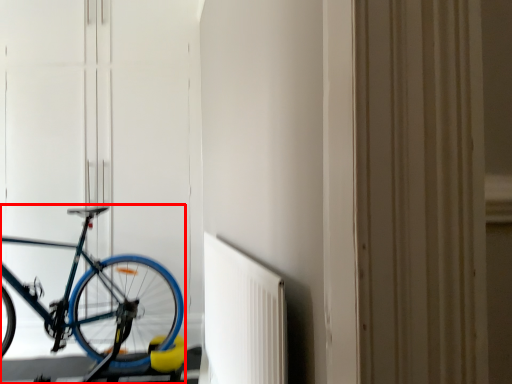
Question: From the image's perspective, where is bicycle (annotated by the red box) located in relation to radiator in the image?

Choices:
 (A) above
 (B) below

Answer: (A)